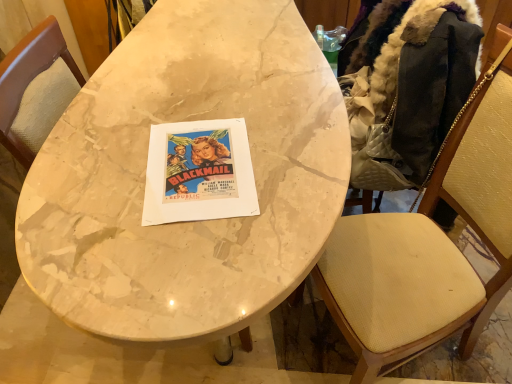
Question: Does marble table at center have a larger size compared to dark brown fur-lined jacket at right?

Choices:
 (A) yes
 (B) no

Answer: (A)

Question: Is marble table at center positioned before dark brown fur-lined jacket at right?

Choices:
 (A) no
 (B) yes

Answer: (B)

Question: From the image's perspective, is marble table at center on dark brown fur-lined jacket at right?

Choices:
 (A) yes
 (B) no

Answer: (B)

Question: Considering the relative positions of marble table at center and dark brown fur-lined jacket at right in the image provided, is marble table at center to the left of dark brown fur-lined jacket at right from the viewer's perspective?

Choices:
 (A) yes
 (B) no

Answer: (A)

Question: Considering the relative sizes of marble table at center and dark brown fur-lined jacket at right in the image provided, is marble table at center wider than dark brown fur-lined jacket at right?

Choices:
 (A) yes
 (B) no

Answer: (A)

Question: Is marble table at center inside or outside of wooden textured chair at right?

Choices:
 (A) outside
 (B) inside

Answer: (A)

Question: In terms of height, does marble table at center look taller or shorter compared to wooden textured chair at right?

Choices:
 (A) short
 (B) tall

Answer: (A)

Question: Is point pyautogui.click(x=268, y=302) closer or farther from the camera than point pyautogui.click(x=446, y=170)?

Choices:
 (A) closer
 (B) farther

Answer: (A)

Question: From the image's perspective, relative to wooden textured chair at right, is marble table at center above or below?

Choices:
 (A) below
 (B) above

Answer: (B)

Question: Based on their sizes in the image, would you say wooden textured chair at right is bigger or smaller than marble table at center?

Choices:
 (A) small
 (B) big

Answer: (A)

Question: Would you say wooden textured chair at right is to the left or to the right of marble table at center in the picture?

Choices:
 (A) left
 (B) right

Answer: (B)

Question: In terms of height, does wooden textured chair at right look taller or shorter compared to marble table at center?

Choices:
 (A) tall
 (B) short

Answer: (A)

Question: Looking at their shapes, would you say wooden textured chair at right is wider or thinner than marble table at center?

Choices:
 (A) wide
 (B) thin

Answer: (B)

Question: From the image's perspective, relative to dark brown fur-lined jacket at right, is marble table at center above or below?

Choices:
 (A) below
 (B) above

Answer: (A)

Question: Is marble table at center situated inside dark brown fur-lined jacket at right or outside?

Choices:
 (A) outside
 (B) inside

Answer: (A)